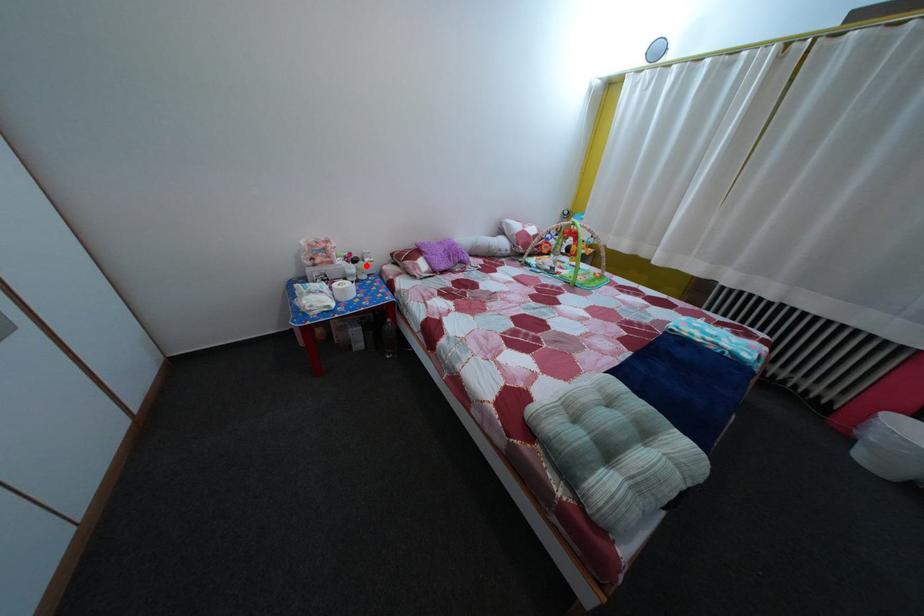
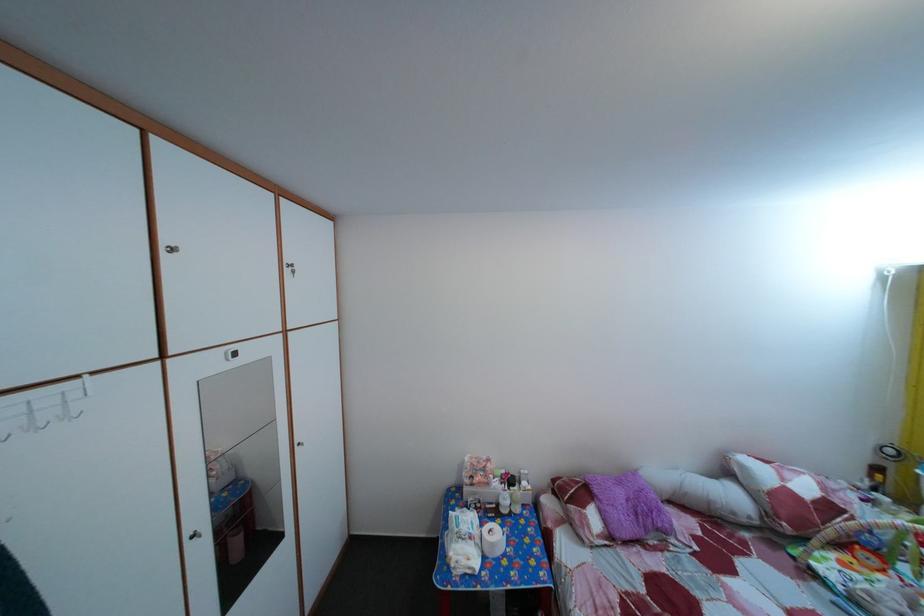
Question: I am providing you with two images of the same scene from different viewpoints. A red point is shown in image1. For the corresponding object point in image2, is it positioned nearer or farther from the camera?

Choices:
 (A) Nearer
 (B) Farther

Answer: (B)